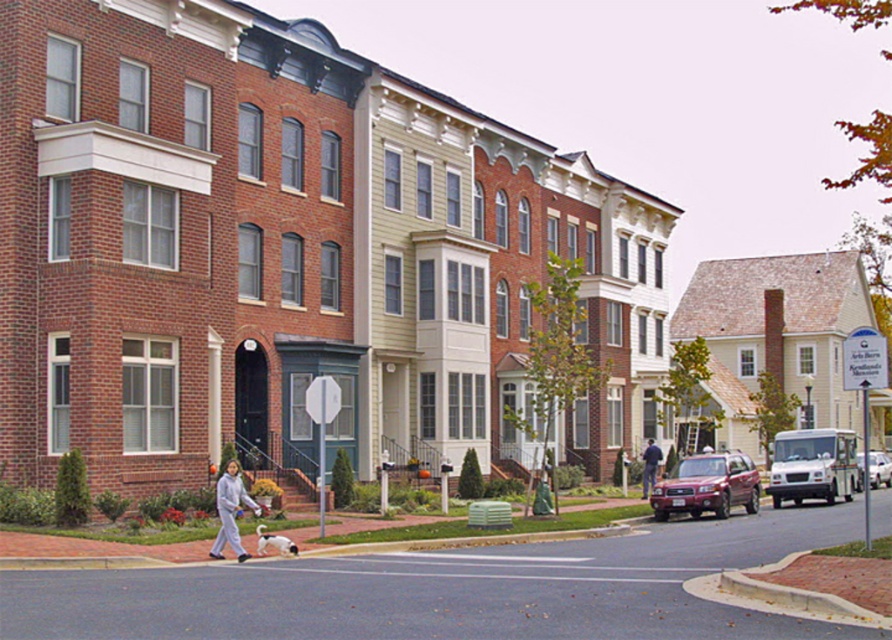
Between matte red suv at center and dark gray pants at center, which one is positioned lower?

matte red suv at center is lower down.

You are a GUI agent. You are given a task and a screenshot of the screen. Output one action in this format:
    pyautogui.click(x=<x>, y=<y>)
    Task: Click on the matte red suv at center
    The height and width of the screenshot is (640, 892).
    Given the screenshot: What is the action you would take?
    pyautogui.click(x=707, y=486)

Does point (746, 477) lie behind point (642, 470)?

That is False.

At what (x,y) coordinates should I click in order to perform the action: click on matte red suv at center. Please return your answer as a coordinate pair (x, y). The image size is (892, 640). Looking at the image, I should click on (707, 486).

Which is below, gray fleece jacket at lower center or metallic silver sedan at center?

metallic silver sedan at center

Who is shorter, gray fleece jacket at lower center or metallic silver sedan at center?

Standing shorter between the two is gray fleece jacket at lower center.

Is point (226, 483) farther from viewer compared to point (885, 456)?

No, (226, 483) is closer to viewer.

This screenshot has height=640, width=892. Identify the location of gray fleece jacket at lower center. (230, 512).

Which is below, metallic silver sedan at center or dark gray pants at center?

Positioned lower is metallic silver sedan at center.

Does metallic silver sedan at center appear on the right side of dark gray pants at center?

Yes, metallic silver sedan at center is to the right of dark gray pants at center.

Who is more forward, (884, 460) or (651, 468)?

Point (651, 468) is more forward.

The height and width of the screenshot is (640, 892). In order to click on metallic silver sedan at center in this screenshot , I will do `click(880, 468)`.